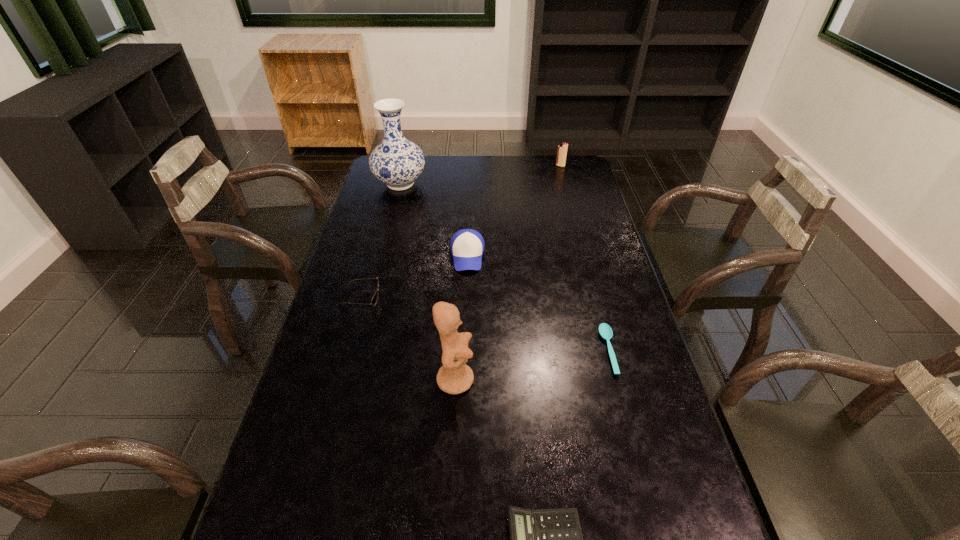
Where is `vacant region located 0.190m on the front-facing side of the figurine`? vacant region located 0.190m on the front-facing side of the figurine is located at coordinates (548, 379).

The width and height of the screenshot is (960, 540). What are the coordinates of `vacant space located 0.360m on the left of the igniter` in the screenshot? It's located at (473, 166).

The height and width of the screenshot is (540, 960). What are the coordinates of `vacant space located 0.400m on the front-facing side of the baseball cap` in the screenshot? It's located at (464, 381).

This screenshot has width=960, height=540. I want to click on vacant space located on the front-facing side of the sunglasses, so click(463, 297).

This screenshot has width=960, height=540. What are the coordinates of `vacant space located 0.110m on the left of the shortest object` in the screenshot? It's located at (562, 350).

Identify the location of vase present at the far edge. (397, 162).

Identify the location of igniter that is at the far edge. (562, 148).

Find the location of a particular element. Image resolution: width=960 pixels, height=540 pixels. vase positioned at the left edge is located at coordinates (397, 162).

At what (x,y) coordinates should I click in order to perform the action: click on sunglasses situated at the left edge. Please return your answer as a coordinate pair (x, y). Looking at the image, I should click on (375, 298).

Locate an element on the screen. igniter at the right edge is located at coordinates [x=562, y=148].